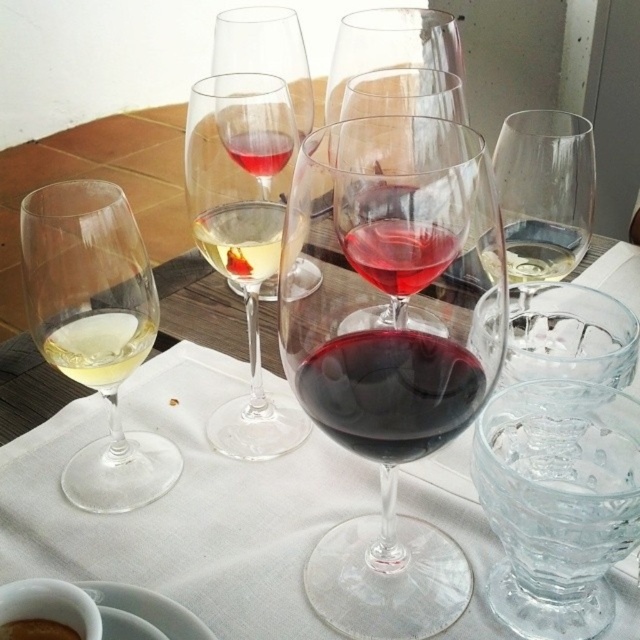
You are a bartender setting up a table for a wine tasting event. You need to place a new wine glass between the transparent glass wine glass at center and the dark red glass at center. According to the spatial arrangement, where should you position the new glass?

The transparent glass wine glass at center is above the dark red glass at center, so you should place the new wine glass between them either above or below depending on the desired arrangement, but according to the existing spatial description, the transparent glass is already positioned above the dark red glass. To maintain the current layout, you might place the new glass either above the transparent glass or below the dark red glass.